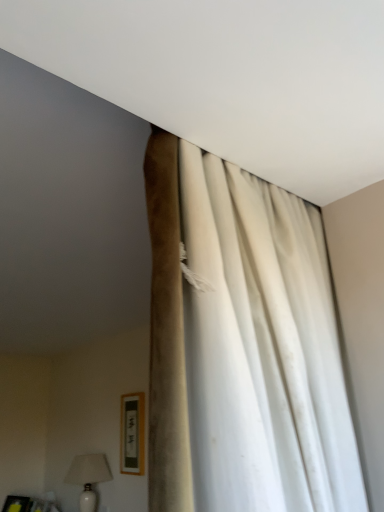
This screenshot has height=512, width=384. Describe the element at coordinates (88, 477) in the screenshot. I see `white ceramic lampshade at lower left` at that location.

The height and width of the screenshot is (512, 384). I want to click on white ceramic lampshade at lower left, so click(88, 477).

The image size is (384, 512). In order to click on white ceramic lampshade at lower left in this screenshot , I will do `click(88, 477)`.